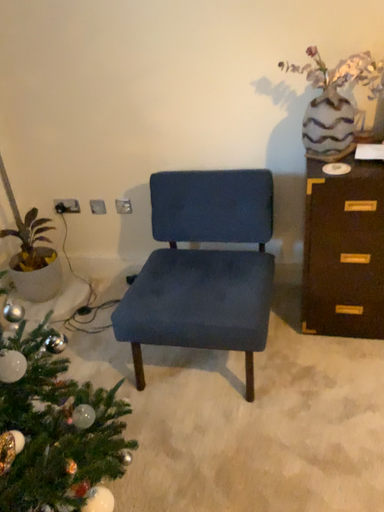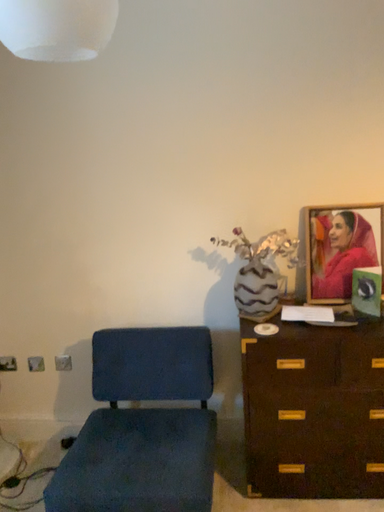
Question: How did the camera likely rotate when shooting the video?

Choices:
 (A) rotated right
 (B) rotated left

Answer: (A)